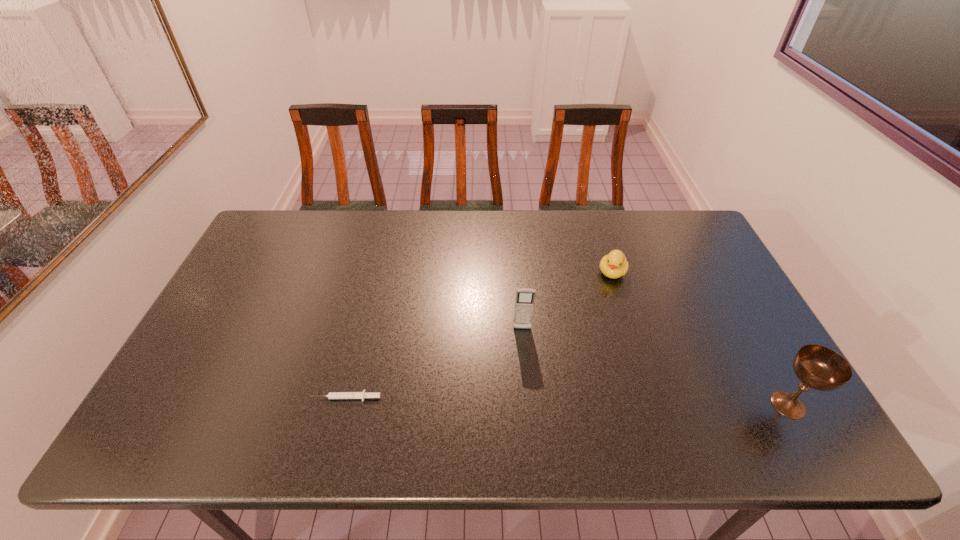
In the image, there is a desktop. Where is `vacant space at the near edge`? The width and height of the screenshot is (960, 540). vacant space at the near edge is located at coordinates (420, 399).

The height and width of the screenshot is (540, 960). I want to click on free space at the left edge of the desktop, so click(222, 366).

The width and height of the screenshot is (960, 540). Find the location of `free space at the right edge of the desktop`. free space at the right edge of the desktop is located at coordinates (732, 336).

In the image, there is a desktop. Where is `blank space at the far left corner`? blank space at the far left corner is located at coordinates (313, 212).

At what (x,y) coordinates should I click in order to perform the action: click on free spot between the farthest object and the third object from right to left. Please return your answer as a coordinate pair (x, y). Looking at the image, I should click on (567, 301).

Where is `free space between the shortest object and the chalice`? This screenshot has height=540, width=960. free space between the shortest object and the chalice is located at coordinates click(x=567, y=401).

This screenshot has height=540, width=960. Find the location of `free spot between the farthest object and the cellular telephone`. free spot between the farthest object and the cellular telephone is located at coordinates (567, 301).

You are a GUI agent. You are given a task and a screenshot of the screen. Output one action in this format:
    pyautogui.click(x=<x>, y=<y>)
    Task: Click on the vacant area that lies between the third tallest object and the leftmost object
    This screenshot has height=540, width=960.
    Given the screenshot: What is the action you would take?
    pyautogui.click(x=479, y=335)

This screenshot has width=960, height=540. I want to click on vacant region between the leftmost object and the farthest object, so click(x=479, y=335).

Find the location of `free space between the rightmost object and the third object from left to right`. free space between the rightmost object and the third object from left to right is located at coordinates (700, 339).